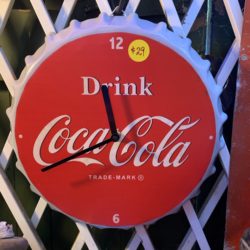
Locate an element on the screen. screw that holds the minute and hour hand to the center of the clock is located at coordinates (116, 138).